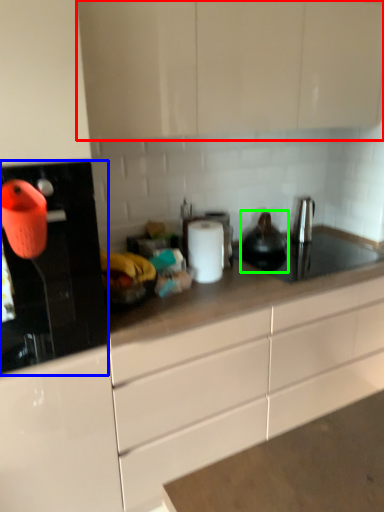
Question: Estimate the real-world distances between objects in this image. Which object is closer to cabinetry (highlighted by a red box), kitchen appliance (highlighted by a blue box) or tea pot (highlighted by a green box)?

Choices:
 (A) kitchen appliance
 (B) tea pot

Answer: (A)